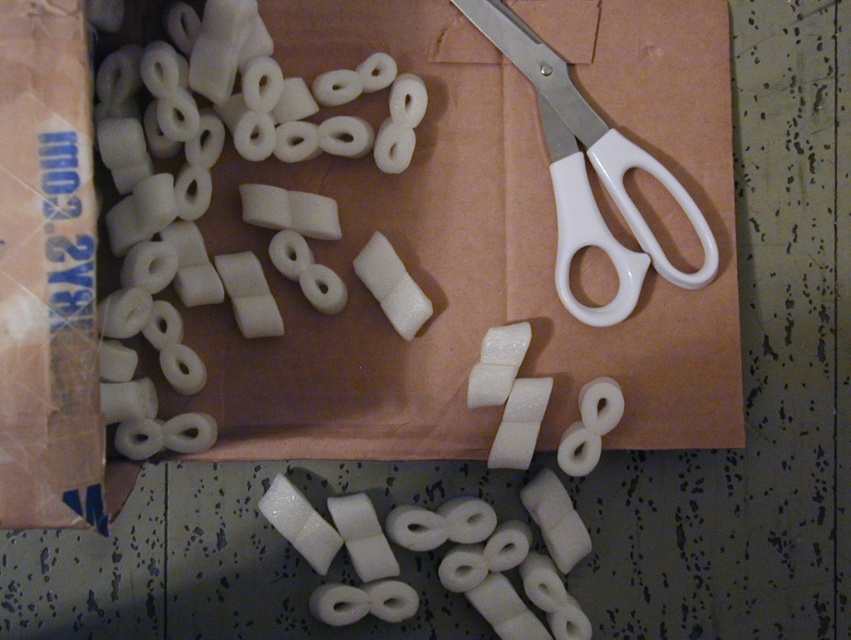
You are organizing items on a shelf and need to place both the matte brown cardboard at upper center and the white matte toilet paper at lower center. Which item should you place first to ensure there is enough space for both?

The matte brown cardboard at upper center is larger in size than the white matte toilet paper at lower center, so you should place the matte brown cardboard at upper center first to ensure there is enough space for both items.

You are trying to place a small object on the closest surface between the matte brown cardboard at upper center and the white matte toilet paper at lower center. Which surface should you choose?

The matte brown cardboard at upper center is closer to the viewer than the white matte toilet paper at lower center, so you should choose the matte brown cardboard at upper center.